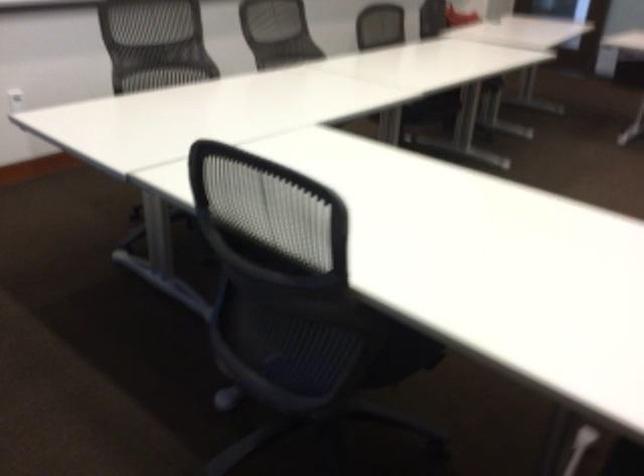
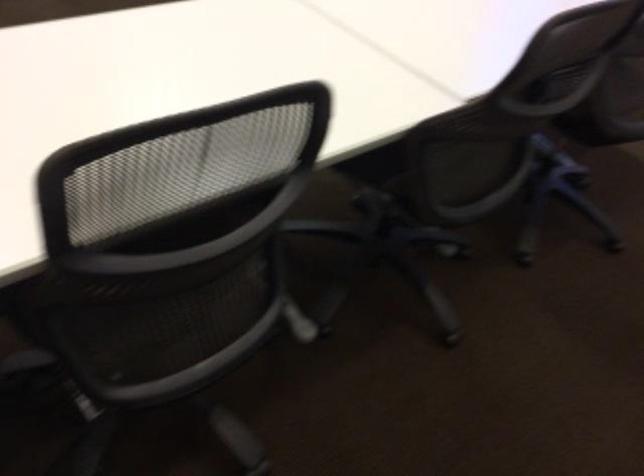
Based on the continuous images, in which direction is the camera rotating?

The camera's rotation is toward right-down.